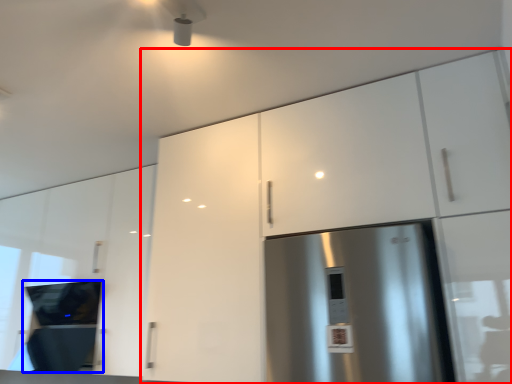
Question: Which object is closer to the camera taking this photo, cabinetry (highlighted by a red box) or appliance (highlighted by a blue box)?

Choices:
 (A) cabinetry
 (B) appliance

Answer: (A)